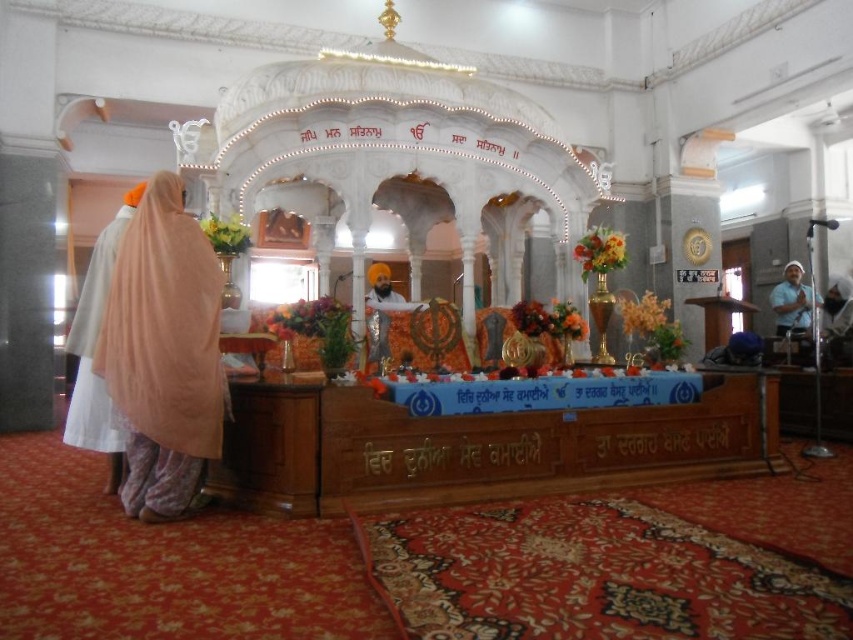
You are standing inside the Gurdwara and notice two decorative fabrics in the room. The light peach sheer at left and the blue fabric at right. Which fabric is positioned lower in the room?

The light peach sheer at left is positioned lower in the room as it is below the blue fabric at right.

You are visiting the Gurdwara and notice two items at the left side of the altar. The light peach sheer at left and the white silk robe at left. Which one is nearer to you?

The light peach sheer at left is closer to the viewer than the white silk robe at left, so the light peach sheer at left is nearer to you.

You are a visitor at the Gurdwara and notice two items near the altar. The white silk robe at left and the blue fabric at right. Which item is positioned closer to the left side of the altar?

The white silk robe at left is positioned closer to the left side of the altar than the blue fabric at right.